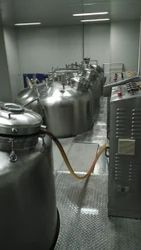
You are a GUI agent. You are given a task and a screenshot of the screen. Output one action in this format:
    pyautogui.click(x=<x>, y=<y>)
    Task: Click on the side vents
    
    Given the screenshot: What is the action you would take?
    pyautogui.click(x=122, y=112), pyautogui.click(x=121, y=119), pyautogui.click(x=121, y=129), pyautogui.click(x=121, y=134), pyautogui.click(x=119, y=161), pyautogui.click(x=119, y=172), pyautogui.click(x=131, y=179), pyautogui.click(x=130, y=168), pyautogui.click(x=133, y=128), pyautogui.click(x=135, y=115)